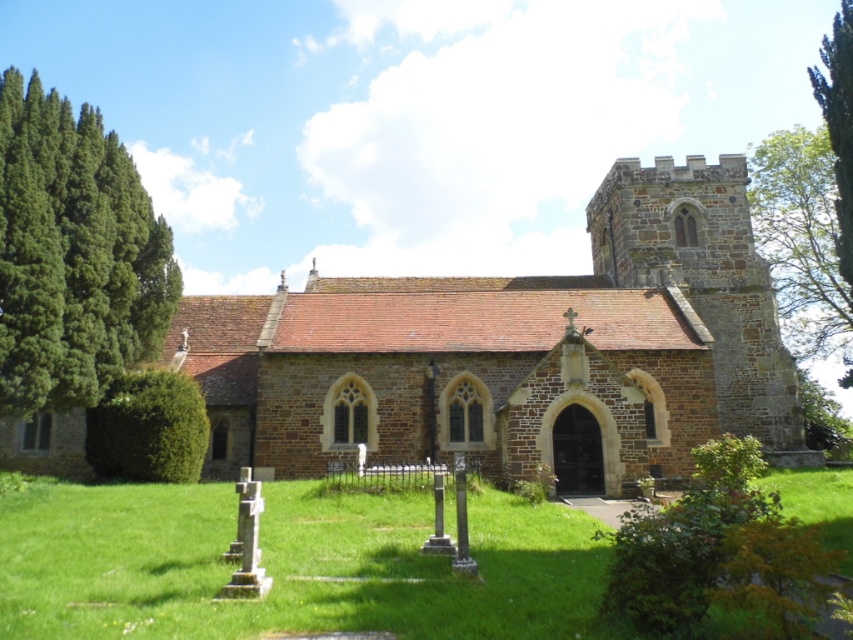
Who is shorter, brown stone church at center or green leafy tree at upper right?

brown stone church at center is shorter.

Which is below, brown stone church at center or green leafy tree at upper right?

brown stone church at center

Which is in front, point (486, 419) or point (807, 196)?

Point (486, 419)

This screenshot has height=640, width=853. What are the coordinates of `brown stone church at center` in the screenshot? It's located at (518, 352).

Does green coniferous tree at left have a greater width compared to green leafy tree at upper right?

No, green coniferous tree at left is not wider than green leafy tree at upper right.

Is point (120, 339) positioned in front of point (788, 241)?

Yes, it is in front of point (788, 241).

Describe the element at coordinates (73, 253) in the screenshot. The width and height of the screenshot is (853, 640). I see `green coniferous tree at left` at that location.

At what (x,y) coordinates should I click in order to perform the action: click on green coniferous tree at left. Please return your answer as a coordinate pair (x, y). Looking at the image, I should click on (73, 253).

Which is more to the right, brown stone church at center or green coniferous tree at left?

brown stone church at center is more to the right.

Who is taller, brown stone church at center or green coniferous tree at left?

With more height is brown stone church at center.

What do you see at coordinates (518, 352) in the screenshot? I see `brown stone church at center` at bounding box center [518, 352].

The width and height of the screenshot is (853, 640). I want to click on brown stone church at center, so click(x=518, y=352).